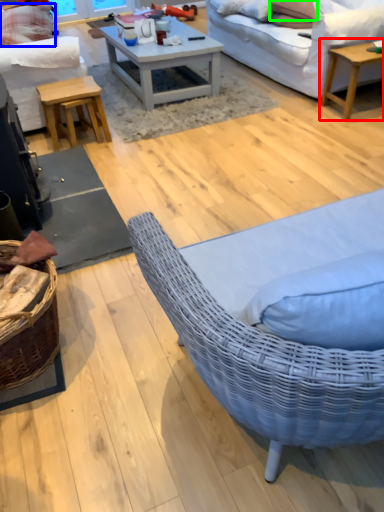
Question: Estimate the real-world distances between objects in this image. Which object is farther from coffee table (highlighted by a red box), pillow (highlighted by a blue box) or pillow (highlighted by a green box)?

Choices:
 (A) pillow
 (B) pillow

Answer: (A)